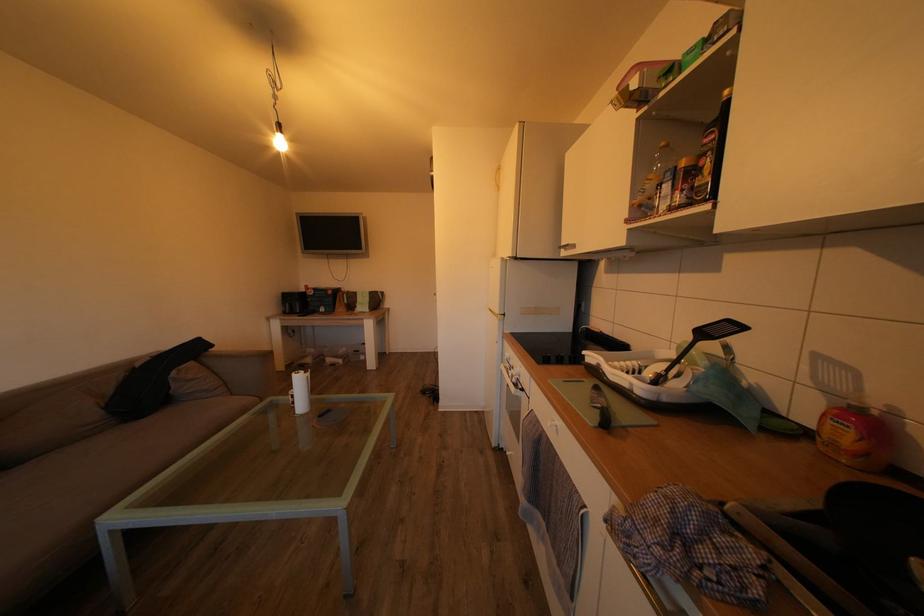
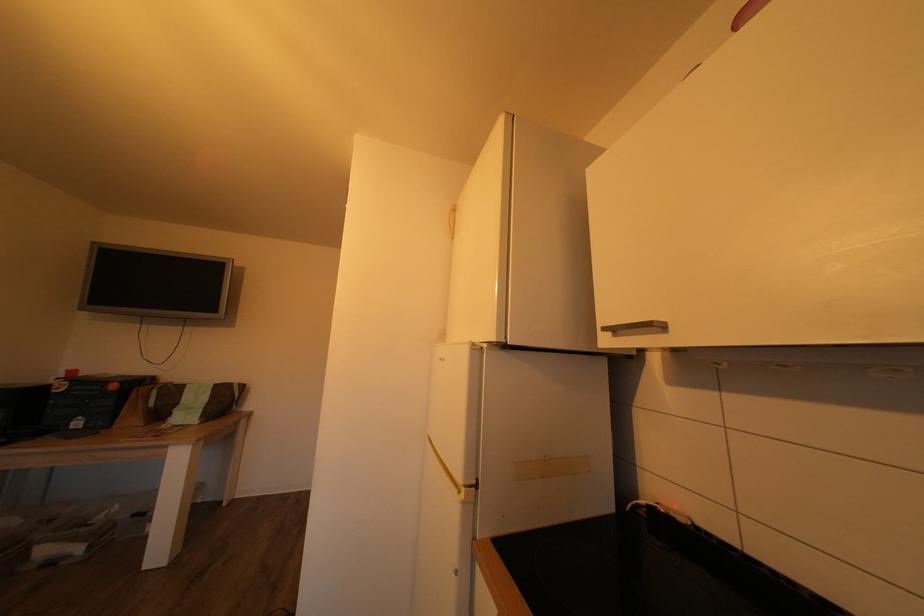
The images are taken continuously from a first-person perspective. In which direction is your viewpoint rotating?

The camera's rotation is toward right-up.